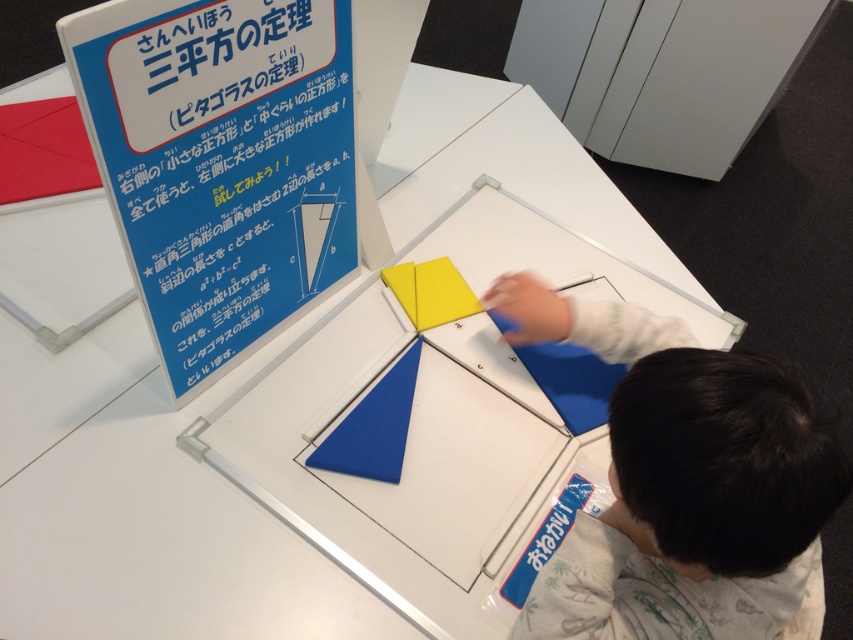
Can you confirm if blue paper sign at upper left is taller than smooth blue fabric at lower right?

Yes, blue paper sign at upper left is taller than smooth blue fabric at lower right.

Between point (247, 17) and point (659, 445), which one is positioned behind?

Point (247, 17)

Locate an element on the screen. The image size is (853, 640). blue paper sign at upper left is located at coordinates (222, 163).